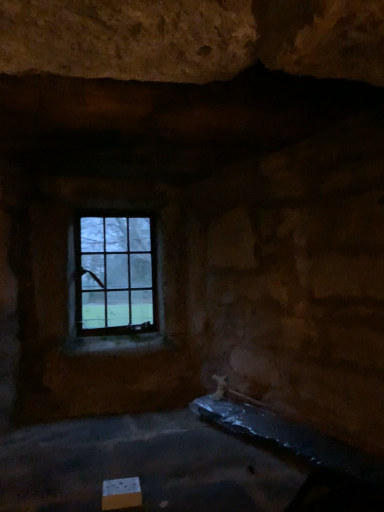
Locate an element on the screen. vacant space behind white cardboard box at lower left is located at coordinates (144, 468).